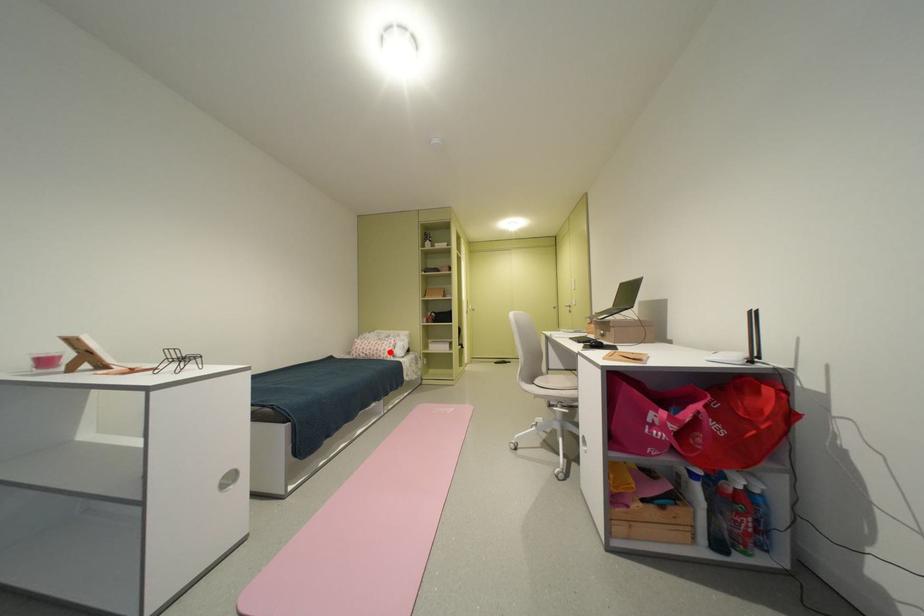
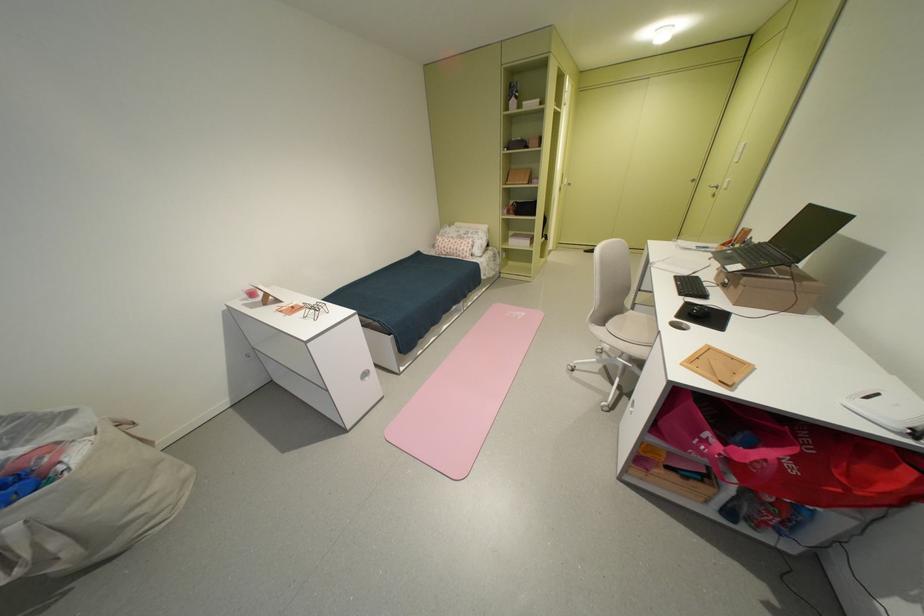
In the second image, find the point that corresponds to the highlighted location in the first image.

(468, 252)